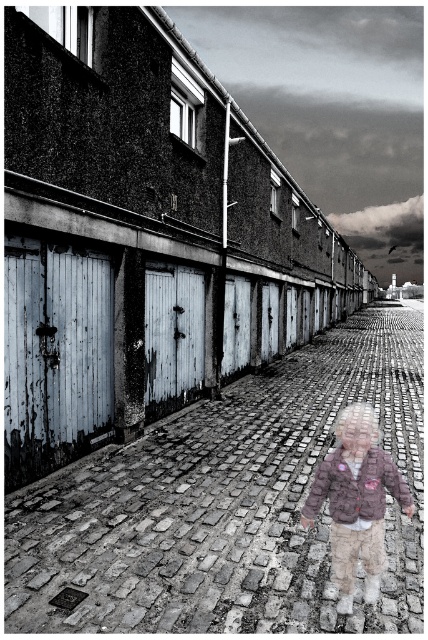
Question: Which point is farther to the camera?

Choices:
 (A) fluffy brown jacket at center
 (B) brick pavement at center

Answer: (A)

Question: From the image, what is the correct spatial relationship of brick pavement at center in relation to fluffy brown jacket at center?

Choices:
 (A) below
 (B) above

Answer: (B)

Question: Is brick pavement at center behind fluffy brown jacket at center?

Choices:
 (A) yes
 (B) no

Answer: (B)

Question: Can you confirm if brick pavement at center is positioned to the left of fluffy brown jacket at center?

Choices:
 (A) no
 (B) yes

Answer: (A)

Question: Which of the following is the farthest from the observer?

Choices:
 (A) fluffy brown jacket at center
 (B) brick pavement at center

Answer: (A)